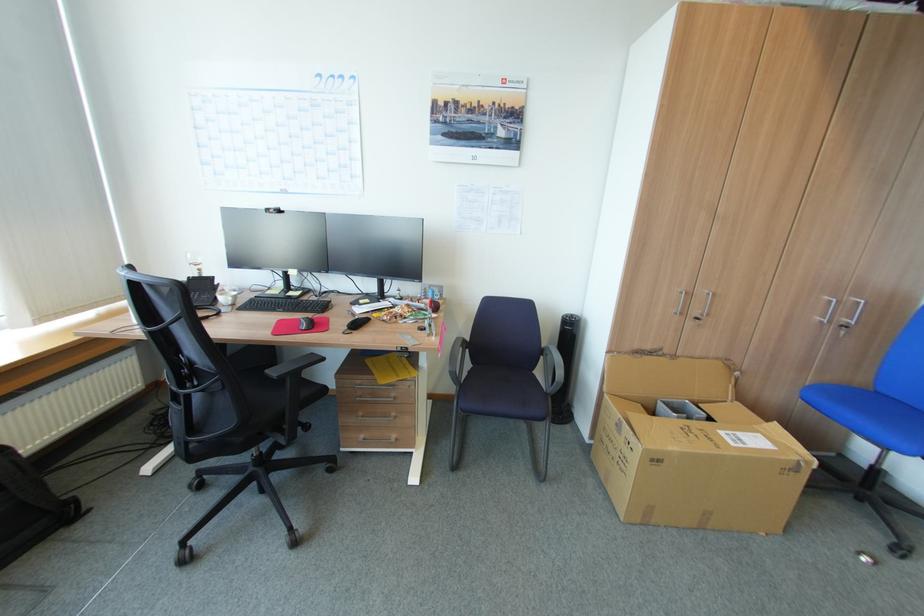
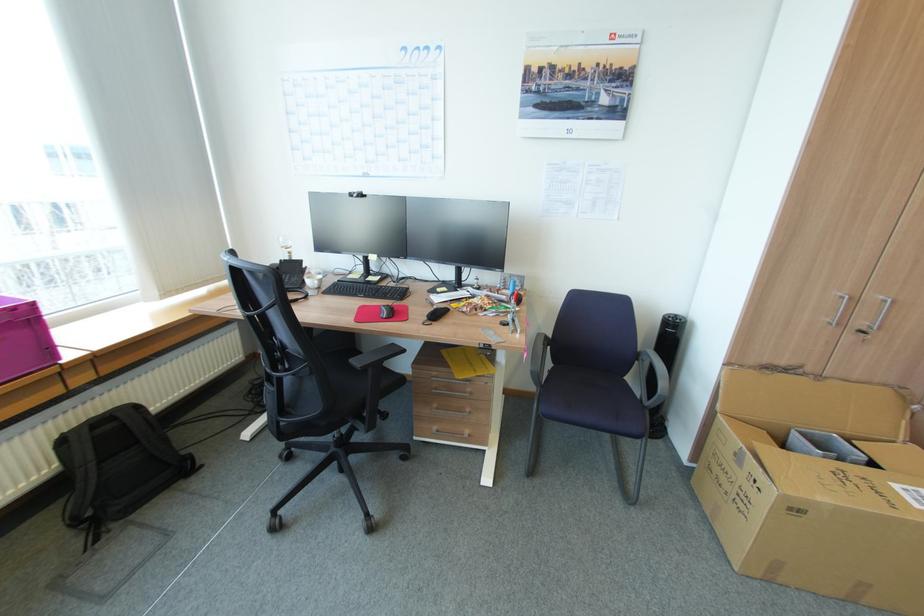
Find the pixel in the second image that matches (x=701, y=318) in the first image.

(868, 331)